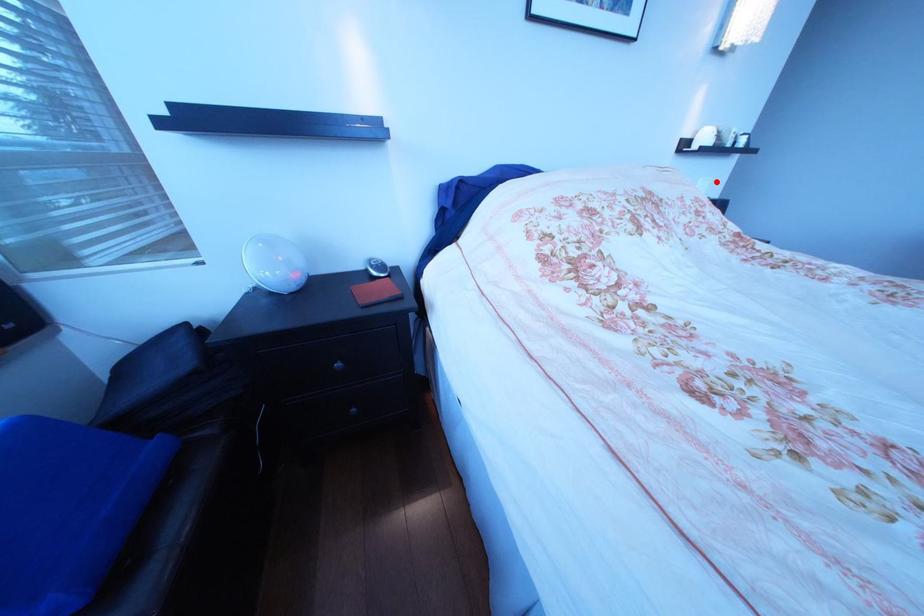
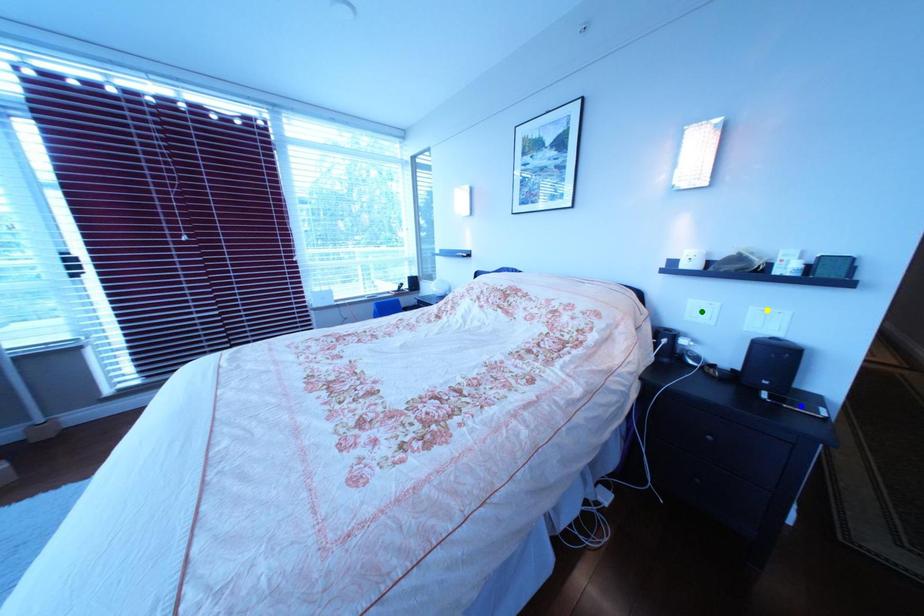
Question: I am providing you with two images of the same scene from different viewpoints. A red point is marked on the first image. You are given multiple points on the second image. Which mark in image 2 goes with the point in image 1?

Choices:
 (A) green point
 (B) blue point
 (C) yellow point

Answer: (C)